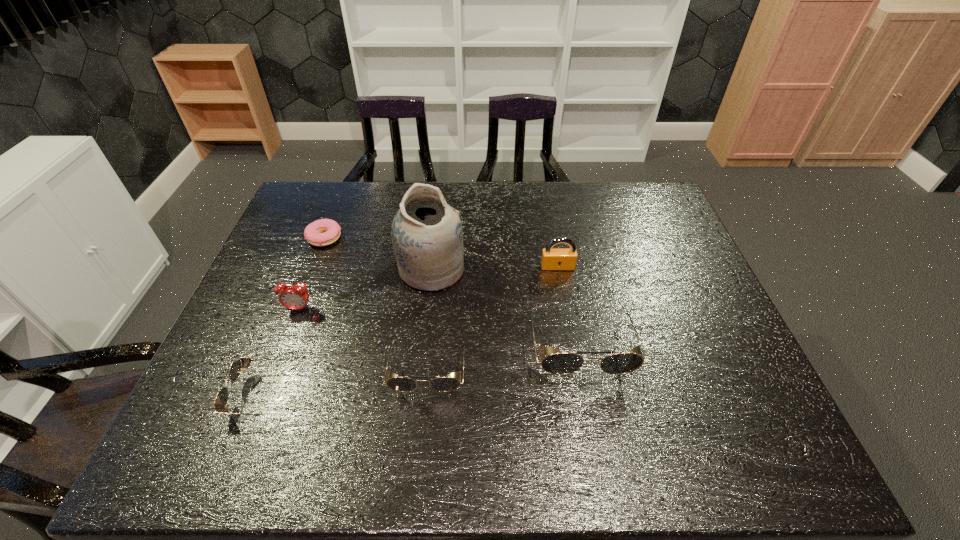
Image resolution: width=960 pixels, height=540 pixels. I want to click on the sixth tallest object, so click(221, 400).

Where is `the shortest sunglasses`? This screenshot has height=540, width=960. the shortest sunglasses is located at coordinates (221, 400).

Image resolution: width=960 pixels, height=540 pixels. Identify the location of the third shortest object. (402, 384).

Image resolution: width=960 pixels, height=540 pixels. What are the coordinates of `the second shortest sunglasses` in the screenshot? It's located at (402, 384).

Where is `the rightmost sunglasses`? the rightmost sunglasses is located at coordinates (558, 363).

Image resolution: width=960 pixels, height=540 pixels. I want to click on the shortest object, so click(x=323, y=232).

Identify the location of alarm clock. The height and width of the screenshot is (540, 960). (295, 297).

Image resolution: width=960 pixels, height=540 pixels. I want to click on padlock, so click(x=552, y=259).

Locate an element on the screen. the tallest object is located at coordinates (427, 237).

Locate an element on the screen. Image resolution: width=960 pixels, height=540 pixels. vacant position located 0.060m on the front lenses of the leftmost sunglasses is located at coordinates (209, 395).